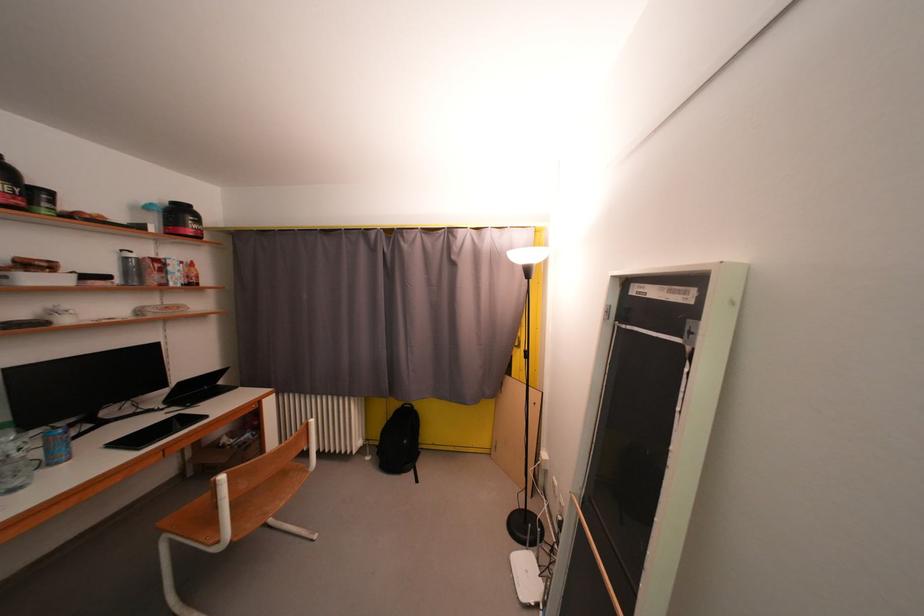
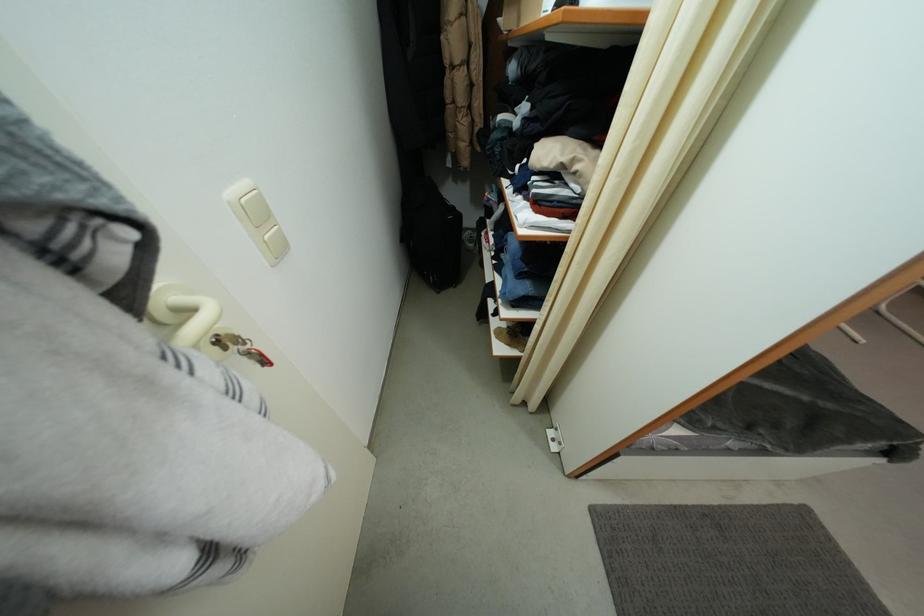
Question: I am providing you with two images of the same scene from different viewpoints. Which of the following objects are not visible in image2?

Choices:
 (A) brown leather shoe
 (B) black laptop
 (C) glass decanter stopper
 (D) light switch button

Answer: (B)